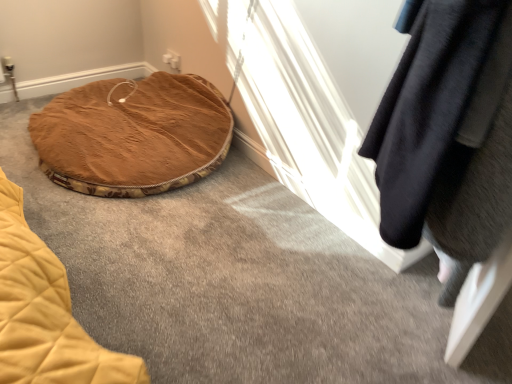
What is the approximate width of brown plush pet bed at lower left?

The width of brown plush pet bed at lower left is 33.84 inches.

What do you see at coordinates (133, 135) in the screenshot? I see `brown plush pet bed at lower left` at bounding box center [133, 135].

Where is `brown plush pet bed at lower left`? brown plush pet bed at lower left is located at coordinates (133, 135).

Measure the distance between brown plush pet bed at lower left and camera.

A distance of 1.80 meters exists between brown plush pet bed at lower left and camera.

Describe the element at coordinates (448, 131) in the screenshot. The image size is (512, 384). I see `black fuzzy blanket at upper right` at that location.

What are the coordinates of `black fuzzy blanket at upper right` in the screenshot? It's located at (448, 131).

What is the approximate width of black fuzzy blanket at upper right?

black fuzzy blanket at upper right is 10.55 inches wide.

Find the location of a particular element. Image resolution: width=512 pixels, height=384 pixels. brown plush pet bed at lower left is located at coordinates (133, 135).

Is brown plush pet bed at lower left at the left side of black fuzzy blanket at upper right?

Yes, brown plush pet bed at lower left is to the left of black fuzzy blanket at upper right.

Does brown plush pet bed at lower left come in front of black fuzzy blanket at upper right?

That is False.

Is point (198, 131) farther from camera compared to point (402, 114)?

Yes, point (198, 131) is behind point (402, 114).

From the image's perspective, is brown plush pet bed at lower left below black fuzzy blanket at upper right?

No, from the image's perspective, brown plush pet bed at lower left is not beneath black fuzzy blanket at upper right.

From a real-world perspective, is brown plush pet bed at lower left above or below black fuzzy blanket at upper right?

Clearly, from a real-world perspective, brown plush pet bed at lower left is below black fuzzy blanket at upper right.

Considering the relative sizes of brown plush pet bed at lower left and black fuzzy blanket at upper right in the image provided, is brown plush pet bed at lower left wider than black fuzzy blanket at upper right?

Yes.

Who is taller, brown plush pet bed at lower left or black fuzzy blanket at upper right?

black fuzzy blanket at upper right is taller.

Considering the sizes of objects brown plush pet bed at lower left and black fuzzy blanket at upper right in the image provided, who is bigger, brown plush pet bed at lower left or black fuzzy blanket at upper right?

brown plush pet bed at lower left.

Is brown plush pet bed at lower left inside or outside of black fuzzy blanket at upper right?

brown plush pet bed at lower left is not inside black fuzzy blanket at upper right, it's outside.

Would you consider brown plush pet bed at lower left to be distant from black fuzzy blanket at upper right?

Yes, brown plush pet bed at lower left is far from black fuzzy blanket at upper right.

Is brown plush pet bed at lower left turned away from black fuzzy blanket at upper right?

No, brown plush pet bed at lower left is not facing away from black fuzzy blanket at upper right.

How different are the orientations of brown plush pet bed at lower left and black fuzzy blanket at upper right in degrees?

brown plush pet bed at lower left and black fuzzy blanket at upper right are facing 62.7 degrees away from each other.

Locate an element on the screen. The image size is (512, 384). clothing that is below the brown plush pet bed at lower left (from the image's perspective) is located at coordinates (448, 131).

Between black fuzzy blanket at upper right and brown plush pet bed at lower left, which one appears on the right side from the viewer's perspective?

From the viewer's perspective, black fuzzy blanket at upper right appears more on the right side.

Between black fuzzy blanket at upper right and brown plush pet bed at lower left, which one is positioned in front?

black fuzzy blanket at upper right is more forward.

Which point is more distant from viewer, (463, 174) or (105, 110)?

The point (105, 110) is farther.

Based on the photo, from the image's perspective, which one is positioned higher, black fuzzy blanket at upper right or brown plush pet bed at lower left?

brown plush pet bed at lower left is shown above in the image.

From a real-world perspective, between black fuzzy blanket at upper right and brown plush pet bed at lower left, who is vertically higher?

black fuzzy blanket at upper right is physically above.

Is black fuzzy blanket at upper right wider or thinner than brown plush pet bed at lower left?

Considering their sizes, black fuzzy blanket at upper right looks slimmer than brown plush pet bed at lower left.

Is black fuzzy blanket at upper right taller or shorter than brown plush pet bed at lower left?

Considering their sizes, black fuzzy blanket at upper right has more height than brown plush pet bed at lower left.

Between black fuzzy blanket at upper right and brown plush pet bed at lower left, which one has larger size?

With larger size is brown plush pet bed at lower left.

Is black fuzzy blanket at upper right outside of brown plush pet bed at lower left?

Absolutely, black fuzzy blanket at upper right is external to brown plush pet bed at lower left.

Are black fuzzy blanket at upper right and brown plush pet bed at lower left beside each other?

No, black fuzzy blanket at upper right is not in contact with brown plush pet bed at lower left.

Is black fuzzy blanket at upper right facing away from brown plush pet bed at lower left?

No, brown plush pet bed at lower left is not at the back of black fuzzy blanket at upper right.

Locate an element on the screen. furniture above the black fuzzy blanket at upper right (from the image's perspective) is located at coordinates (133, 135).

This screenshot has width=512, height=384. What are the coordinates of `furniture to the left of black fuzzy blanket at upper right` in the screenshot? It's located at (133, 135).

Identify the location of clothing that appears below the brown plush pet bed at lower left (from the image's perspective). The height and width of the screenshot is (384, 512). (448, 131).